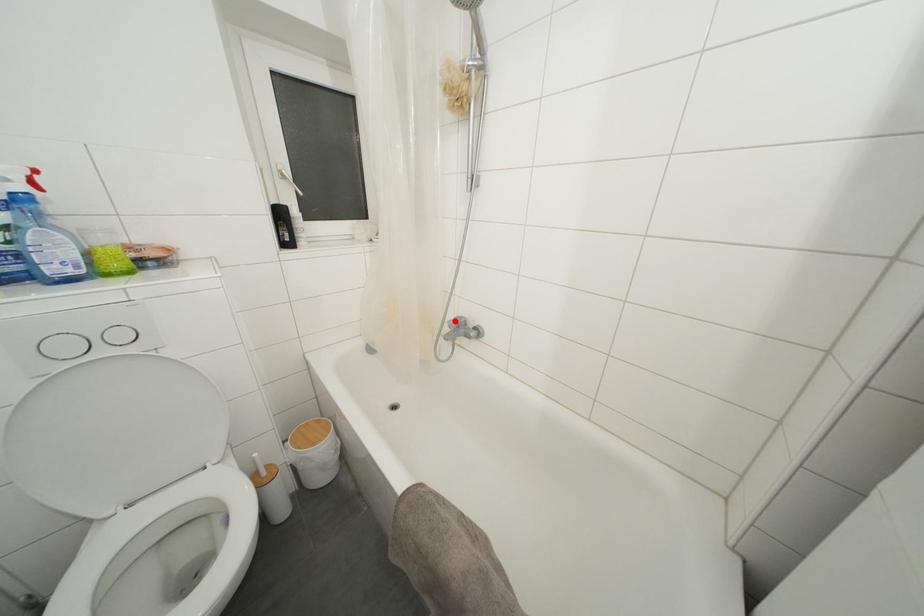
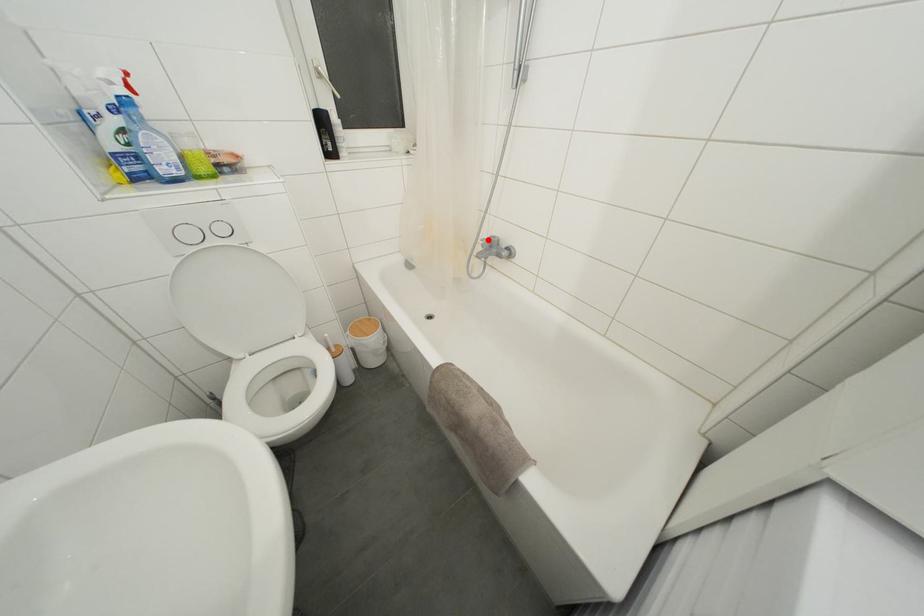
I am providing you with two images of the same scene from different viewpoints. A red point is marked on the first image and another point is marked on the second image. Do the highlighted points in image1 and image2 indicate the same real-world spot?

Yes